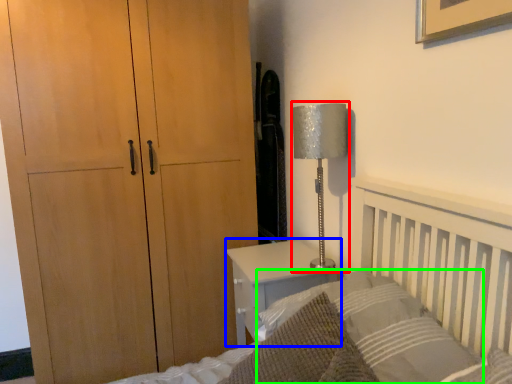
Question: Based on their relative distances, which object is nearer to table lamp (highlighted by a red box)? Choose from nightstand (highlighted by a blue box) and pillow (highlighted by a green box).

Choices:
 (A) nightstand
 (B) pillow

Answer: (A)